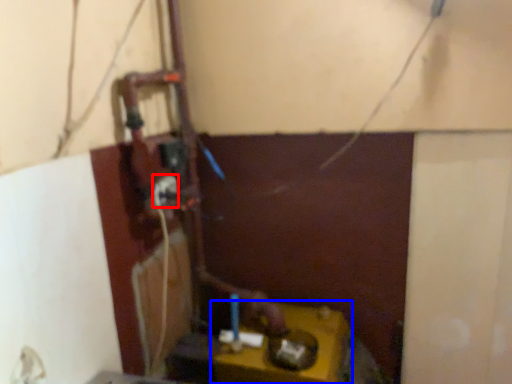
Question: Which object appears closest to the camera in this image, power plugs and sockets (highlighted by a red box) or table (highlighted by a blue box)?

Choices:
 (A) power plugs and sockets
 (B) table

Answer: (B)